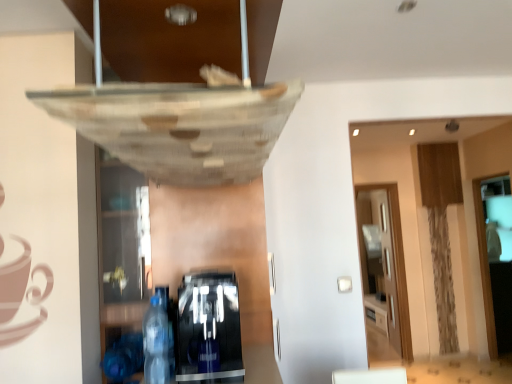
Question: Is transparent wood glass door at right, placed as the 2th glass door when sorted from front to back, looking in the opposite direction of transparent plastic bottle at lower left?

Choices:
 (A) no
 (B) yes

Answer: (A)

Question: Can you confirm if transparent wood glass door at right, placed as the 2th glass door when sorted from front to back, is positioned to the left of transparent plastic bottle at lower left?

Choices:
 (A) no
 (B) yes

Answer: (A)

Question: From a real-world perspective, is transparent wood glass door at right, which is counted as the 1th glass door, starting from the left, physically above transparent plastic bottle at lower left?

Choices:
 (A) no
 (B) yes

Answer: (A)

Question: From the image's perspective, is transparent wood glass door at right, placed as the 2th glass door when sorted from front to back, above transparent plastic bottle at lower left?

Choices:
 (A) yes
 (B) no

Answer: (B)

Question: From a real-world perspective, is transparent wood glass door at right, which is counted as the 1th glass door, starting from the left, beneath transparent plastic bottle at lower left?

Choices:
 (A) yes
 (B) no

Answer: (A)

Question: Is black glossy coffee machine at lower center, the second shelf in the left-to-right sequence, smaller than transparent glass shelf at lower left, which is the 1th shelf in left-to-right order?

Choices:
 (A) no
 (B) yes

Answer: (A)

Question: Can you confirm if black glossy coffee machine at lower center, the second shelf in the left-to-right sequence, is shorter than transparent glass shelf at lower left, which is the second shelf in right-to-left order?

Choices:
 (A) no
 (B) yes

Answer: (B)

Question: Does black glossy coffee machine at lower center, the first shelf when ordered from right to left, have a greater height compared to transparent glass shelf at lower left, which is the second shelf in right-to-left order?

Choices:
 (A) no
 (B) yes

Answer: (A)

Question: Considering the relative sizes of black glossy coffee machine at lower center, the second shelf in the left-to-right sequence, and transparent glass shelf at lower left, which is the 1th shelf in left-to-right order, in the image provided, is black glossy coffee machine at lower center, the second shelf in the left-to-right sequence, thinner than transparent glass shelf at lower left, which is the 1th shelf in left-to-right order,?

Choices:
 (A) yes
 (B) no

Answer: (B)

Question: From a real-world perspective, is black glossy coffee machine at lower center, the first shelf when ordered from right to left, over transparent glass shelf at lower left, which is the 1th shelf in left-to-right order?

Choices:
 (A) no
 (B) yes

Answer: (A)

Question: Is black glossy coffee machine at lower center, the first shelf when ordered from right to left, in front of transparent glass shelf at lower left, which is the second shelf in right-to-left order?

Choices:
 (A) yes
 (B) no

Answer: (B)

Question: Considering the relative sizes of transparent wood glass door at right, placed as the second glass door when sorted from right to left, and black glossy coffee machine at lower center, the second shelf in the left-to-right sequence, in the image provided, is transparent wood glass door at right, placed as the second glass door when sorted from right to left, bigger than black glossy coffee machine at lower center, the second shelf in the left-to-right sequence,?

Choices:
 (A) no
 (B) yes

Answer: (A)